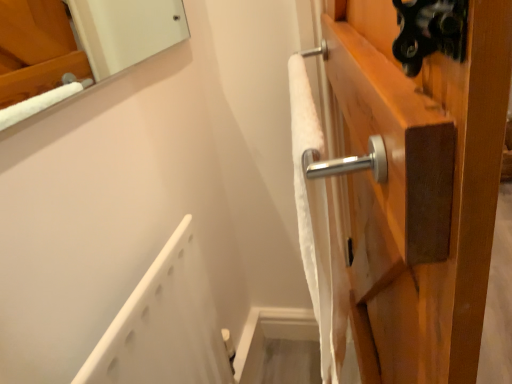
Question: From the image's perspective, relative to white soft towel at upper right, is satin wood door handle at upper right above or below?

Choices:
 (A) above
 (B) below

Answer: (B)

Question: From a real-world perspective, is satin wood door handle at upper right above or below white soft towel at upper right?

Choices:
 (A) above
 (B) below

Answer: (B)

Question: Estimate the real-world distances between objects in this image. Which object is closer to the satin wood door handle at upper right?

Choices:
 (A) white soft towel at upper right
 (B) white plastic bath at lower left

Answer: (A)

Question: Which is nearer to the white soft towel at upper right?

Choices:
 (A) satin wood door handle at upper right
 (B) white plastic bath at lower left

Answer: (A)